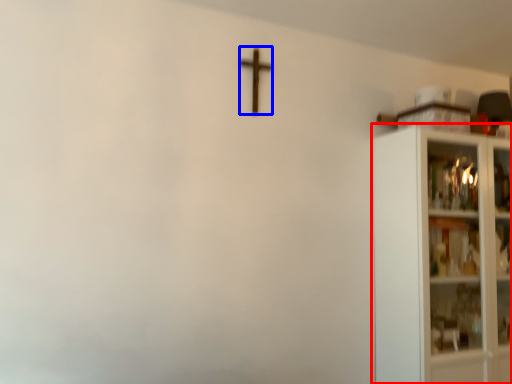
Question: Among these objects, which one is nearest to the camera, shelf (highlighted by a red box) or crucifix (highlighted by a blue box)?

Choices:
 (A) shelf
 (B) crucifix

Answer: (A)